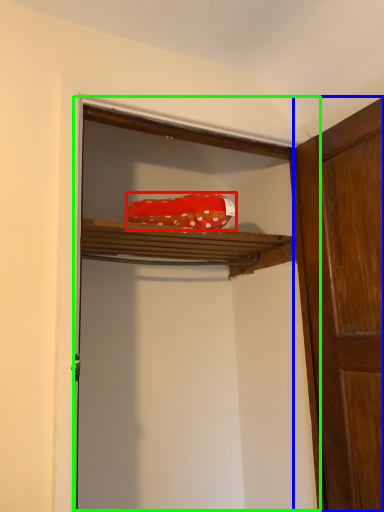
Question: Based on their relative distances, which object is nearer to material (highlighted by a red box)? Choose from door (highlighted by a blue box) and cabinetry (highlighted by a green box).

Choices:
 (A) door
 (B) cabinetry

Answer: (A)